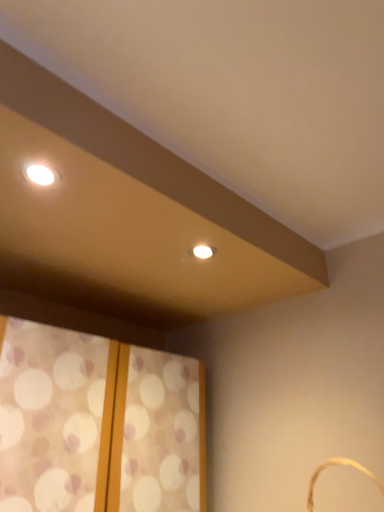
Question: Can you confirm if gold woven basket at lower right is shorter than patterned fabric window at lower left?

Choices:
 (A) no
 (B) yes

Answer: (B)

Question: Considering the relative sizes of gold woven basket at lower right and patterned fabric window at lower left in the image provided, is gold woven basket at lower right bigger than patterned fabric window at lower left?

Choices:
 (A) no
 (B) yes

Answer: (A)

Question: Does gold woven basket at lower right lie behind patterned fabric window at lower left?

Choices:
 (A) yes
 (B) no

Answer: (B)

Question: From a real-world perspective, is gold woven basket at lower right beneath patterned fabric window at lower left?

Choices:
 (A) no
 (B) yes

Answer: (B)

Question: Would you say gold woven basket at lower right is outside patterned fabric window at lower left?

Choices:
 (A) no
 (B) yes

Answer: (B)

Question: Is gold woven basket at lower right at the left side of patterned fabric window at lower left?

Choices:
 (A) yes
 (B) no

Answer: (B)

Question: Is patterned fabric window at lower left in contact with gold woven basket at lower right?

Choices:
 (A) no
 (B) yes

Answer: (A)

Question: Can you confirm if patterned fabric window at lower left is taller than gold woven basket at lower right?

Choices:
 (A) no
 (B) yes

Answer: (B)

Question: From a real-world perspective, is patterned fabric window at lower left positioned under gold woven basket at lower right based on gravity?

Choices:
 (A) no
 (B) yes

Answer: (A)

Question: Considering the relative positions of patterned fabric window at lower left and gold woven basket at lower right in the image provided, is patterned fabric window at lower left to the left of gold woven basket at lower right from the viewer's perspective?

Choices:
 (A) yes
 (B) no

Answer: (A)

Question: Considering the relative sizes of patterned fabric window at lower left and gold woven basket at lower right in the image provided, is patterned fabric window at lower left shorter than gold woven basket at lower right?

Choices:
 (A) yes
 (B) no

Answer: (B)

Question: Is patterned fabric window at lower left not inside gold woven basket at lower right?

Choices:
 (A) yes
 (B) no

Answer: (A)

Question: Looking at the image, does patterned fabric window at lower left seem bigger or smaller compared to gold woven basket at lower right?

Choices:
 (A) big
 (B) small

Answer: (A)